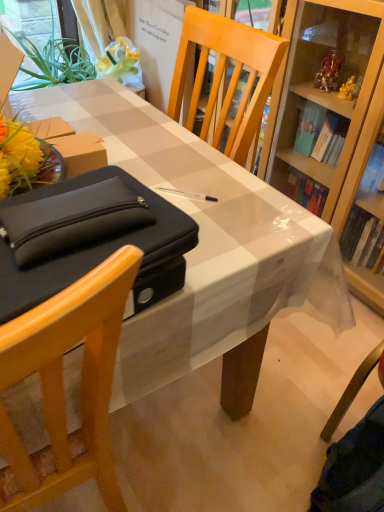
Question: Does black fabric pouch at left turn towards matte black bag at left?

Choices:
 (A) no
 (B) yes

Answer: (A)

Question: Is black fabric pouch at left at the left side of matte black bag at left?

Choices:
 (A) no
 (B) yes

Answer: (A)

Question: Can you confirm if black fabric pouch at left is shorter than matte black bag at left?

Choices:
 (A) no
 (B) yes

Answer: (B)

Question: From the image's perspective, is black fabric pouch at left below matte black bag at left?

Choices:
 (A) no
 (B) yes

Answer: (A)

Question: Are black fabric pouch at left and matte black bag at left beside each other?

Choices:
 (A) no
 (B) yes

Answer: (A)

Question: Looking at the image, does black fabric pouch at left seem bigger or smaller compared to matte black bag at left?

Choices:
 (A) big
 (B) small

Answer: (B)

Question: Considering their positions, is black fabric pouch at left located in front of or behind matte black bag at left?

Choices:
 (A) front
 (B) behind

Answer: (B)

Question: From their relative heights in the image, would you say black fabric pouch at left is taller or shorter than matte black bag at left?

Choices:
 (A) tall
 (B) short

Answer: (B)

Question: From a real-world perspective, is black fabric pouch at left physically located above or below matte black bag at left?

Choices:
 (A) below
 (B) above

Answer: (B)

Question: From a real-world perspective, is matte black bag at left above or below black fabric pouch at left?

Choices:
 (A) below
 (B) above

Answer: (A)

Question: Considering the relative positions of matte black bag at left and black fabric pouch at left in the image provided, is matte black bag at left to the left or to the right of black fabric pouch at left?

Choices:
 (A) right
 (B) left

Answer: (B)

Question: Considering the positions of matte black bag at left and black fabric pouch at left in the image, is matte black bag at left taller or shorter than black fabric pouch at left?

Choices:
 (A) short
 (B) tall

Answer: (B)

Question: Is point (31, 346) closer or farther from the camera than point (31, 298)?

Choices:
 (A) farther
 (B) closer

Answer: (B)

Question: In the image, is black fabric pouch at left on the left side or the right side of white glossy desk at center?

Choices:
 (A) left
 (B) right

Answer: (A)

Question: Considering the positions of black fabric pouch at left and white glossy desk at center in the image, is black fabric pouch at left bigger or smaller than white glossy desk at center?

Choices:
 (A) big
 (B) small

Answer: (B)